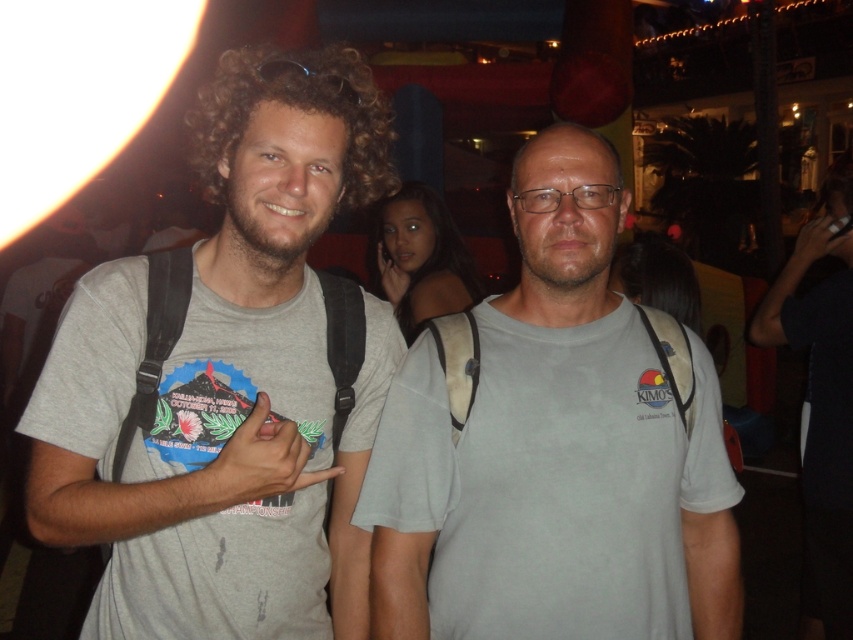
Question: Which object is farther from the camera taking this photo?

Choices:
 (A) gray cotton t-shirt at left
 (B) gray cotton t-shirt at center

Answer: (B)

Question: Does gray cotton t-shirt at left appear over gray cotton t-shirt at center?

Choices:
 (A) no
 (B) yes

Answer: (B)

Question: Which point appears closest to the camera in this image?

Choices:
 (A) (241, 122)
 (B) (529, 442)

Answer: (A)

Question: Is gray cotton t-shirt at left positioned behind gray cotton t-shirt at center?

Choices:
 (A) no
 (B) yes

Answer: (A)

Question: Among these points, which one is nearest to the camera?

Choices:
 (A) (38, 419)
 (B) (595, 234)

Answer: (A)

Question: Is gray cotton t-shirt at left bigger than gray cotton t-shirt at center?

Choices:
 (A) yes
 (B) no

Answer: (A)